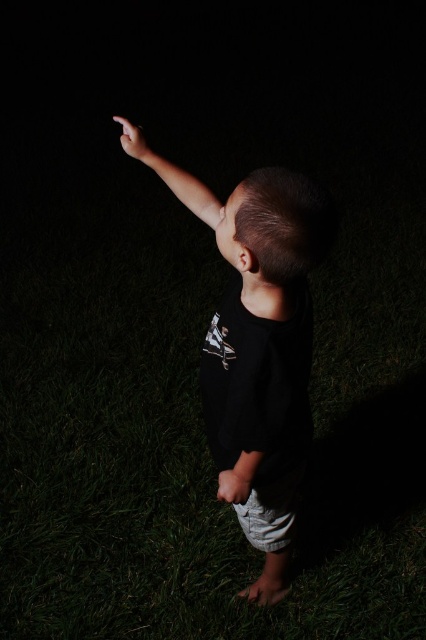
You are a photographer trying to capture the child in the image. You want to ensure the black matte shirt at center and the white matte hand at lower center are both visible in the photo. Which object should you focus on first to ensure both are in frame?

The black matte shirt at center is positioned on the right side of white matte hand at lower center. To ensure both are in frame, focus on the white matte hand at lower center first as it is closer to the center and adjust the camera angle to include the black matte shirt at center on its right side.

You are a photographer adjusting your camera settings to capture the scene of the child pointing upwards. The camera has a focus point at coordinates 0.275, 0.404. Which object should you focus on to ensure the matte black arm at upper left is sharp?

The matte black arm at upper left is located at point (172, 176), so focusing the camera at that coordinate will ensure the matte black arm at upper left is in sharp focus.

You are a photographer trying to capture the child pointing at something in the night sky. From the perspective of the camera, which object is positioned lower in the frame between the matte black arm at upper left and the matte black finger at upper right?

The matte black arm at upper left is positioned lower in the frame than the matte black finger at upper right.